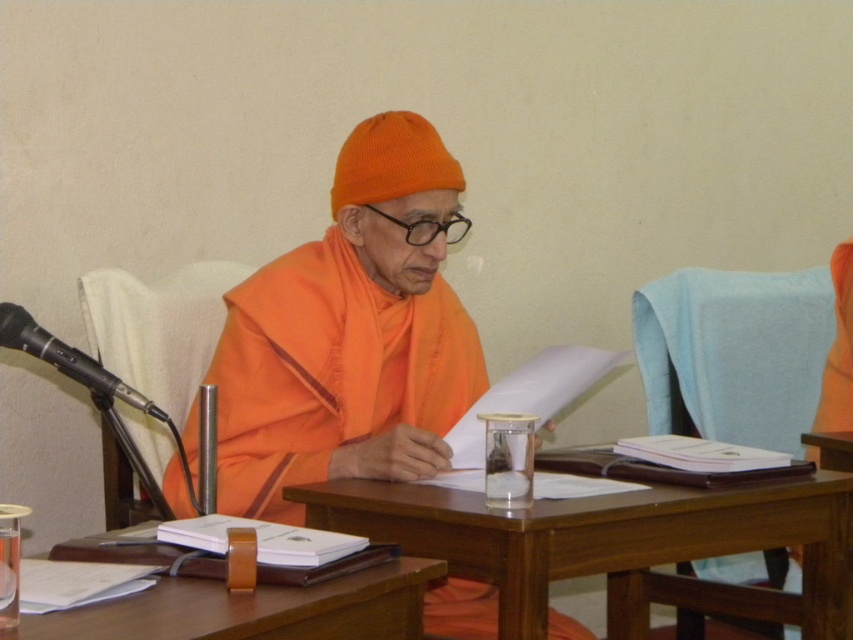
Is orange clothed figure at center positioned in front of wooden table at center?

No, it is not.

Does orange clothed figure at center have a greater height compared to wooden table at center?

Yes.

What do you see at coordinates (351, 333) in the screenshot? I see `orange clothed figure at center` at bounding box center [351, 333].

At what (x,y) coordinates should I click in order to perform the action: click on orange clothed figure at center. Please return your answer as a coordinate pair (x, y). This screenshot has height=640, width=853. Looking at the image, I should click on (351, 333).

Between wooden table at center and black plastic microphone at left, which one has more height?

Standing taller between the two is wooden table at center.

Who is positioned more to the right, wooden table at center or black plastic microphone at left?

Positioned to the right is wooden table at center.

The image size is (853, 640). I want to click on wooden table at center, so click(x=614, y=545).

Where is `wooden table at center`? The width and height of the screenshot is (853, 640). wooden table at center is located at coordinates (614, 545).

Does blue fabric chair at right appear on the left side of black plastic microphone at left?

In fact, blue fabric chair at right is to the right of black plastic microphone at left.

Between blue fabric chair at right and black plastic microphone at left, which one is positioned lower?

black plastic microphone at left is below.

Find the location of `blue fabric chair at right`. blue fabric chair at right is located at coordinates [735, 352].